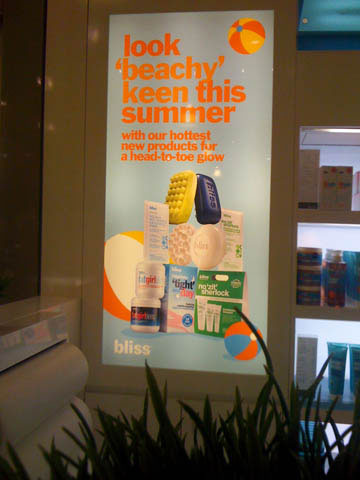
Image resolution: width=360 pixels, height=480 pixels. Find the location of `shelf`. shelf is located at coordinates (317, 312), (321, 409).